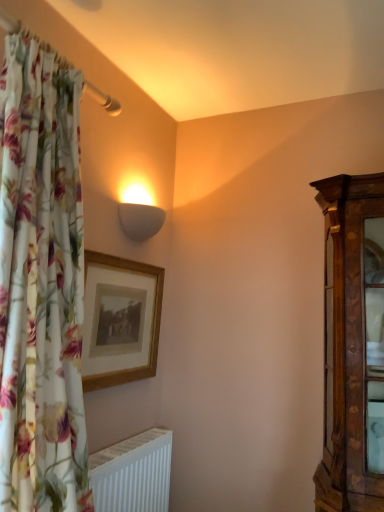
Describe the element at coordinates (133, 473) in the screenshot. I see `white matte radiator at lower left` at that location.

This screenshot has width=384, height=512. I want to click on white matte radiator at lower left, so click(x=133, y=473).

Where is `white matte radiator at lower left`? This screenshot has width=384, height=512. white matte radiator at lower left is located at coordinates (133, 473).

Is wooden picture frame at upper center aimed at white matte wall sconce at upper center?

No, wooden picture frame at upper center is not aimed at white matte wall sconce at upper center.

Who is shorter, wooden picture frame at upper center or white matte wall sconce at upper center?

Standing shorter between the two is white matte wall sconce at upper center.

Considering the points (117, 303) and (127, 218), which point is behind, point (117, 303) or point (127, 218)?

The point (127, 218) is behind.

Is wooden picture frame at upper center closer to the viewer compared to white matte wall sconce at upper center?

Yes, the depth of wooden picture frame at upper center is less than that of white matte wall sconce at upper center.

From the image's perspective, is white matte radiator at lower left above white matte wall sconce at upper center?

No, from the image's perspective, white matte radiator at lower left is not above white matte wall sconce at upper center.

How different are the orientations of white matte radiator at lower left and white matte wall sconce at upper center in degrees?

1.36 degrees.

Considering the relative positions of white matte radiator at lower left and white matte wall sconce at upper center in the image provided, is white matte radiator at lower left to the right of white matte wall sconce at upper center from the viewer's perspective?

Incorrect, white matte radiator at lower left is not on the right side of white matte wall sconce at upper center.

Is white matte radiator at lower left directly adjacent to white matte wall sconce at upper center?

No.

Is white matte radiator at lower left aimed at wooden picture frame at upper center?

No, white matte radiator at lower left is not facing towards wooden picture frame at upper center.

In order to click on radiator on the right of wooden picture frame at upper center in this screenshot , I will do `click(133, 473)`.

Consider the image. Does white matte radiator at lower left appear on the left side of wooden picture frame at upper center?

No, white matte radiator at lower left is not to the left of wooden picture frame at upper center.

Can wooden picture frame at upper center be found inside white matte radiator at lower left?

No, white matte radiator at lower left does not contain wooden picture frame at upper center.

Considering the sizes of objects white matte wall sconce at upper center and wooden picture frame at upper center in the image provided, who is thinner, white matte wall sconce at upper center or wooden picture frame at upper center?

wooden picture frame at upper center is thinner.

Is there a large distance between white matte wall sconce at upper center and wooden picture frame at upper center?

No, white matte wall sconce at upper center is not far away from wooden picture frame at upper center.

Looking at this image, is white matte wall sconce at upper center at the right side of wooden picture frame at upper center?

Yes, white matte wall sconce at upper center is to the right of wooden picture frame at upper center.

Can you tell me how much white matte wall sconce at upper center and wooden picture frame at upper center differ in facing direction?

white matte wall sconce at upper center and wooden picture frame at upper center are facing 1.36 degrees away from each other.

Is white matte wall sconce at upper center closer to camera compared to white matte radiator at lower left?

No, white matte wall sconce at upper center is behind white matte radiator at lower left.

From the image's perspective, which object appears higher, white matte wall sconce at upper center or white matte radiator at lower left?

white matte wall sconce at upper center appears higher in the image.

Is white matte wall sconce at upper center surrounding white matte radiator at lower left?

Actually, white matte radiator at lower left is outside white matte wall sconce at upper center.

The height and width of the screenshot is (512, 384). What are the coordinates of `radiator that is in front of the wooden picture frame at upper center` in the screenshot? It's located at (133, 473).

How different are the orientations of wooden picture frame at upper center and white matte radiator at lower left in degrees?

The angular difference between wooden picture frame at upper center and white matte radiator at lower left is 0.0097 degrees.

In the scene shown: Is wooden picture frame at upper center bigger or smaller than white matte radiator at lower left?

Considering their sizes, wooden picture frame at upper center takes up less space than white matte radiator at lower left.

Where is `lamp that is on the right side of wooden picture frame at upper center`? lamp that is on the right side of wooden picture frame at upper center is located at coordinates (140, 214).

In order to click on radiator in front of the white matte wall sconce at upper center in this screenshot , I will do `click(133, 473)`.

Considering their positions, is wooden picture frame at upper center positioned further to white matte radiator at lower left than white matte wall sconce at upper center?

white matte wall sconce at upper center is positioned further to the anchor white matte radiator at lower left.

Based on their spatial positions, is white matte radiator at lower left or wooden picture frame at upper center closer to white matte wall sconce at upper center?

wooden picture frame at upper center is positioned closer to the anchor white matte wall sconce at upper center.

In the scene shown: When comparing their distances from wooden picture frame at upper center, does white matte wall sconce at upper center or white matte radiator at lower left seem closer?

white matte wall sconce at upper center lies closer to wooden picture frame at upper center than the other object.

Which object lies further to the anchor point white matte radiator at lower left, white matte wall sconce at upper center or wooden picture frame at upper center?

Among the two, white matte wall sconce at upper center is located further to white matte radiator at lower left.

Estimate the real-world distances between objects in this image. Which object is further from wooden picture frame at upper center, white matte radiator at lower left or white matte wall sconce at upper center?

white matte radiator at lower left.

Based on their spatial positions, is wooden picture frame at upper center or white matte radiator at lower left further from white matte wall sconce at upper center?

Among the two, white matte radiator at lower left is located further to white matte wall sconce at upper center.

This screenshot has height=512, width=384. Identify the location of picture frame that lies between white matte wall sconce at upper center and white matte radiator at lower left from top to bottom. (120, 320).